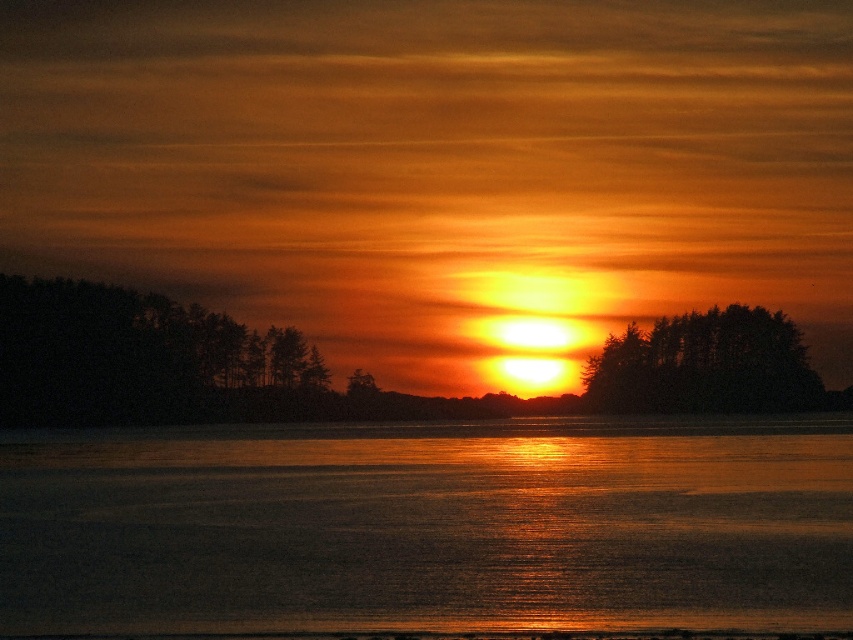
You are standing at the edge of the water in the sunset scene. There is a point marked at coordinates point (430, 525). What is located at that point?

The point (430, 525) is where the glistening water at center is located.

You are an artist planning to paint the sunset scene. You want to emphasize the contrast between the dark green textured trees at left and the dark green textured trees at center. Which tree group should you paint larger to maintain the scene accuracy?

The dark green textured trees at left are larger in size compared to the dark green textured trees at center, so to maintain accuracy, you should paint the dark green textured trees at left larger than the dark green textured trees at center.

You are a photographer standing at the center of the scene. You want to capture both the dark green textured trees at left and dark green textured trees at center in a single wide shot. The camera you are using has a maximum focal length that allows capturing objects up to 30 meters apart. Will you be able to include both trees in your photo?

The dark green textured trees at left and dark green textured trees at center are 31.29 meters apart. Since the maximum focal length allows capturing objects up to 30 meters apart, you will not be able to include both trees in a single wide shot.